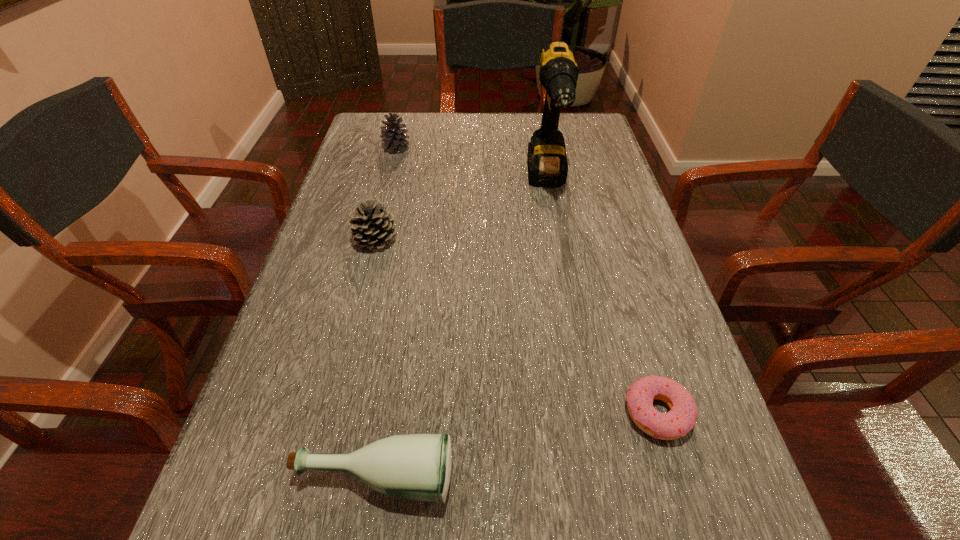
The image size is (960, 540). In the image, there is a desktop. Identify the location of vacant space at the right edge. (x=644, y=290).

In order to click on free location at the far left corner of the desktop in this screenshot , I will do `click(372, 119)`.

This screenshot has width=960, height=540. I want to click on free area in between the farther pinecone and the bottle, so click(386, 313).

At what (x,y) coordinates should I click in order to perform the action: click on free area in between the fourth object from left to right and the farther pinecone. Please return your answer as a coordinate pair (x, y). This screenshot has height=540, width=960. Looking at the image, I should click on (471, 165).

Find the location of a particular element. The image size is (960, 540). unoccupied area between the shortest object and the tallest object is located at coordinates (602, 297).

Find the location of `vacant space that is in between the farther pinecone and the second object from right to left`. vacant space that is in between the farther pinecone and the second object from right to left is located at coordinates click(x=471, y=165).

Where is `free space between the nearest object and the rightmost object`? The height and width of the screenshot is (540, 960). free space between the nearest object and the rightmost object is located at coordinates (516, 445).

You are a GUI agent. You are given a task and a screenshot of the screen. Output one action in this format:
    pyautogui.click(x=<x>, y=<y>)
    Task: Click on the empty space between the bottle and the drill
    
    Given the screenshot: What is the action you would take?
    pyautogui.click(x=461, y=329)

Locate an element on the screen. The height and width of the screenshot is (540, 960). free spot between the drill and the nearer pinecone is located at coordinates (462, 211).

The image size is (960, 540). What are the coordinates of `free spot between the drill and the nearer pinecone` in the screenshot? It's located at (462, 211).